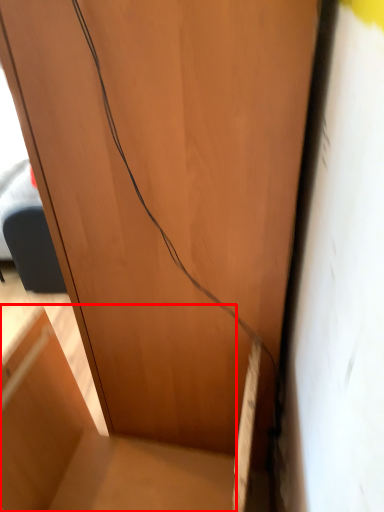
Question: From the image's perspective, where is furniture (annotated by the red box) located relative to wire?

Choices:
 (A) above
 (B) below

Answer: (B)